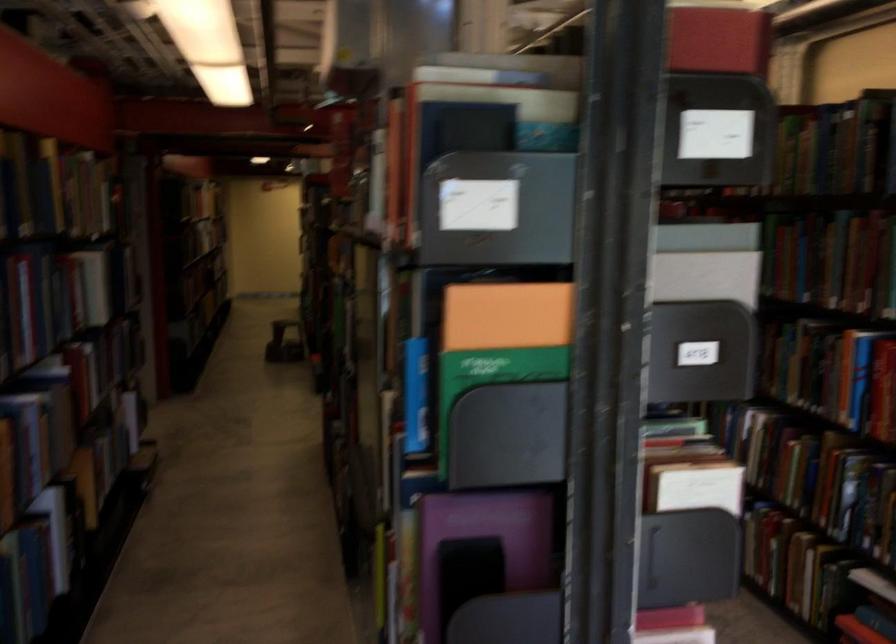
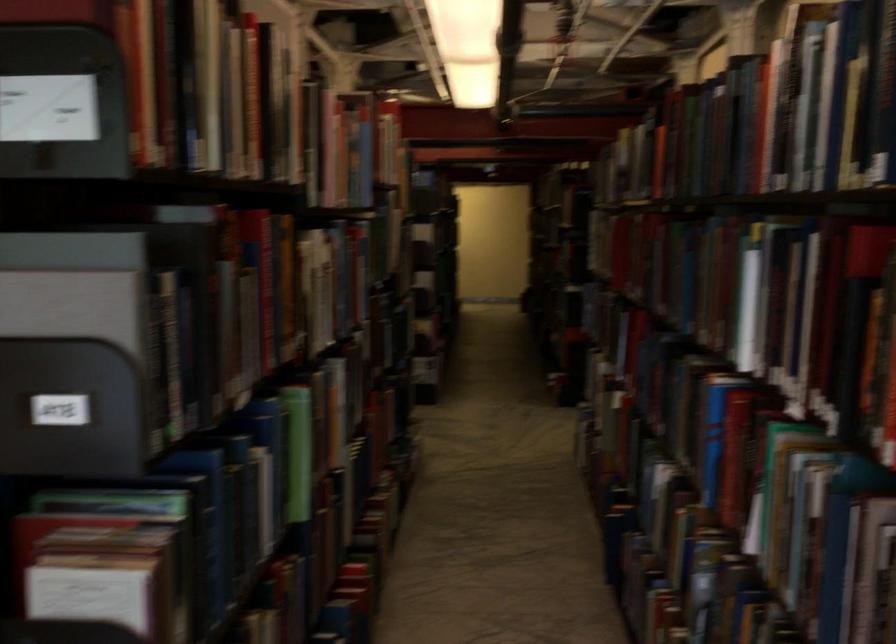
Locate, in the second image, the point that corresponds to pixel 685 278 in the first image.

(67, 303)